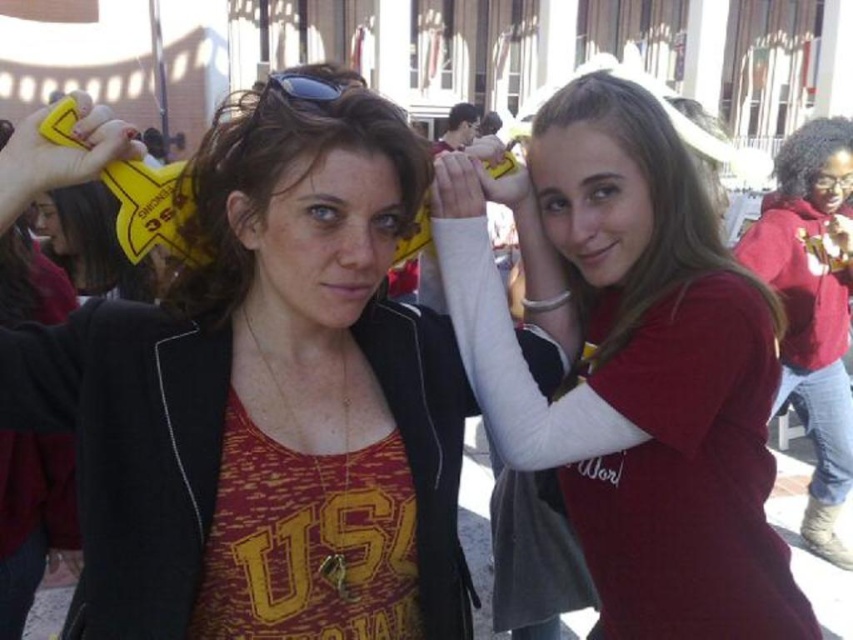
The width and height of the screenshot is (853, 640). Find the location of `matte black jacket at center`. matte black jacket at center is located at coordinates (x=267, y=401).

What are the coordinates of `matte black jacket at center` in the screenshot? It's located at (267, 401).

Image resolution: width=853 pixels, height=640 pixels. Find the location of `matte black jacket at center`. matte black jacket at center is located at coordinates (267, 401).

Does matte black jacket at center have a lesser width compared to matte black hair at center?

No, matte black jacket at center is not thinner than matte black hair at center.

Which is in front, point (225, 435) or point (310, 140)?

Point (310, 140) is more forward.

Which is behind, point (323, 529) or point (201, 147)?

The point (201, 147) is more distant.

Locate an element on the screen. The height and width of the screenshot is (640, 853). matte black jacket at center is located at coordinates (267, 401).

Does matte black jacket at center appear over matte red hoodie at right?

Actually, matte black jacket at center is below matte red hoodie at right.

Is matte black jacket at center thinner than matte red hoodie at right?

Incorrect, matte black jacket at center's width is not less than matte red hoodie at right's.

Locate an element on the screen. The height and width of the screenshot is (640, 853). matte black jacket at center is located at coordinates (267, 401).